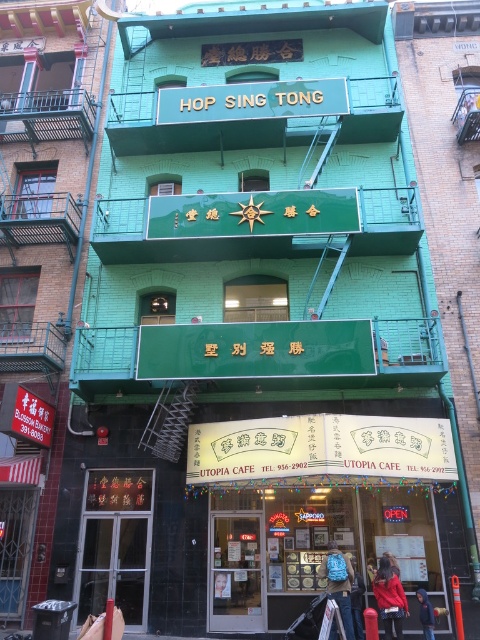
Question: Which of the following is the closest to the observer?

Choices:
 (A) (21, 449)
 (B) (342, 554)

Answer: (B)

Question: Which of the following is the closest to the observer?

Choices:
 (A) (338, 563)
 (B) (326, 540)
 (C) (6, 592)

Answer: (A)

Question: Can you confirm if blue fabric bag at center is thinner than dark blue hoodie at lower right?

Choices:
 (A) yes
 (B) no

Answer: (B)

Question: In this image, where is red fabric coat at lower right located relative to dark blue hoodie at lower right?

Choices:
 (A) left
 (B) right

Answer: (A)

Question: Is matte yellow signboard at center bigger than dark blue hoodie at lower right?

Choices:
 (A) no
 (B) yes

Answer: (B)

Question: Estimate the real-world distances between objects in this image. Which object is closer to the red fabric coat at lower right?

Choices:
 (A) matte yellow signboard at center
 (B) dark blue hoodie at lower right
 (C) green matte building at center
 (D) blue fabric bag at center

Answer: (B)